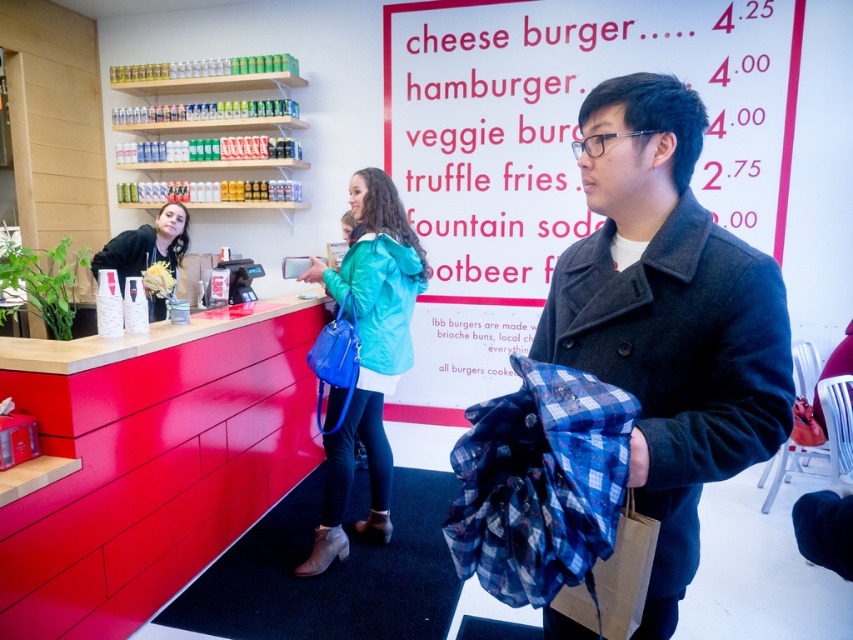
Question: Which point is farther to the camera?

Choices:
 (A) matte black hoodie at center
 (B) teal fabric jacket at center

Answer: (A)

Question: Is dark wool coat at center further to camera compared to matte black hoodie at center?

Choices:
 (A) no
 (B) yes

Answer: (A)

Question: Which point is closer to the camera taking this photo?

Choices:
 (A) (672, 433)
 (B) (148, 257)

Answer: (A)

Question: From the image, what is the correct spatial relationship of teal fabric jacket at center in relation to matte black hoodie at center?

Choices:
 (A) above
 (B) below

Answer: (B)

Question: Which of the following is the farthest from the observer?

Choices:
 (A) (328, 289)
 (B) (619, 195)

Answer: (A)

Question: Can you confirm if dark wool coat at center is positioned below teal fabric jacket at center?

Choices:
 (A) yes
 (B) no

Answer: (B)